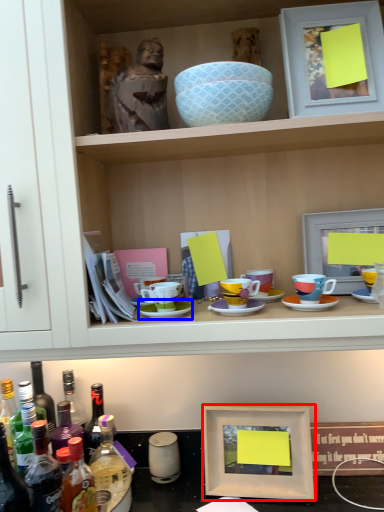
Question: Which object appears farthest to the camera in this image, picture frame (highlighted by a red box) or saucer (highlighted by a blue box)?

Choices:
 (A) picture frame
 (B) saucer

Answer: (A)